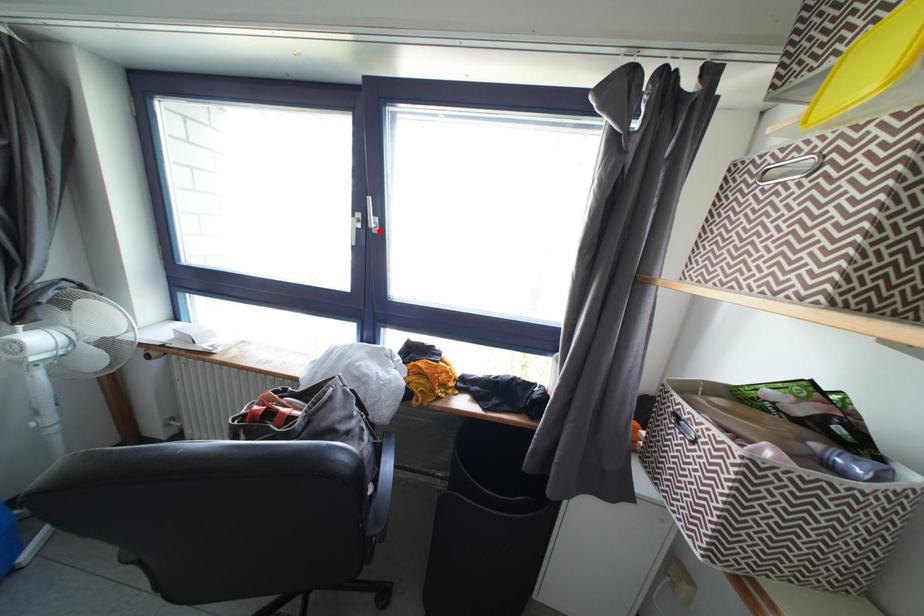
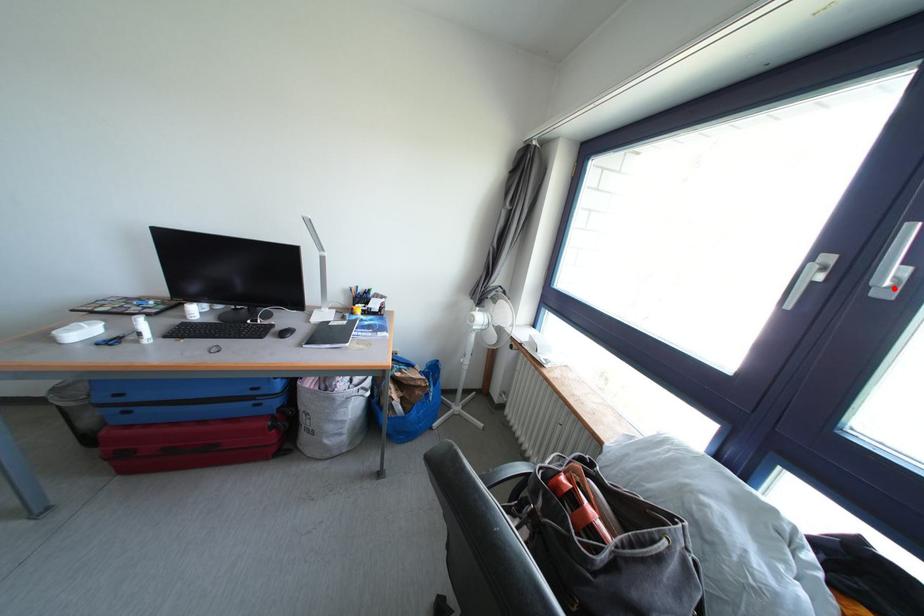
I am providing you with two images of the same scene from different viewpoints. A red point is marked on the first image and another point is marked on the second image. Does the point marked in image1 correspond to the same location as the one in image2?

Yes